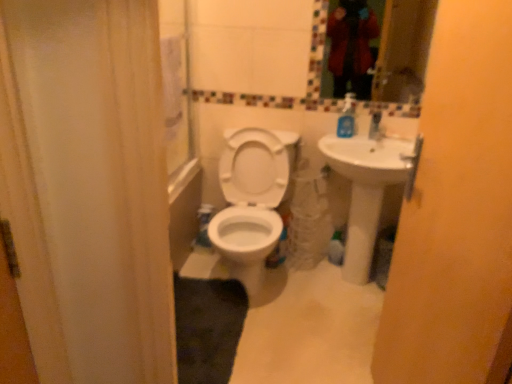
Where is `empty space that is in between white glossy toilet at center and white glossy sink at right`? This screenshot has height=384, width=512. empty space that is in between white glossy toilet at center and white glossy sink at right is located at coordinates (318, 306).